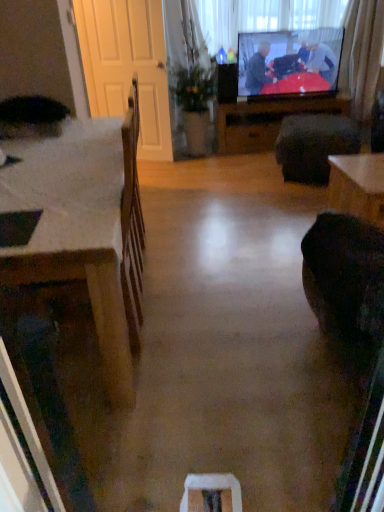
Question: Does green leafy plant at center have a lesser height compared to flat screen tv at upper center?

Choices:
 (A) no
 (B) yes

Answer: (A)

Question: Does green leafy plant at center have a greater width compared to flat screen tv at upper center?

Choices:
 (A) no
 (B) yes

Answer: (B)

Question: Is green leafy plant at center far away from flat screen tv at upper center?

Choices:
 (A) yes
 (B) no

Answer: (B)

Question: Is flat screen tv at upper center inside green leafy plant at center?

Choices:
 (A) yes
 (B) no

Answer: (B)

Question: Considering the relative positions of green leafy plant at center and flat screen tv at upper center in the image provided, is green leafy plant at center to the left of flat screen tv at upper center from the viewer's perspective?

Choices:
 (A) yes
 (B) no

Answer: (A)

Question: Considering the positions of transparent plastic window screen at upper center and white wooden screen door at left in the image, is transparent plastic window screen at upper center wider or thinner than white wooden screen door at left?

Choices:
 (A) wide
 (B) thin

Answer: (A)

Question: Visually, is transparent plastic window screen at upper center positioned to the left or to the right of white wooden screen door at left?

Choices:
 (A) left
 (B) right

Answer: (B)

Question: Is transparent plastic window screen at upper center taller or shorter than white wooden screen door at left?

Choices:
 (A) tall
 (B) short

Answer: (B)

Question: Considering the positions of point (200, 20) and point (132, 46), is point (200, 20) closer or farther from the camera than point (132, 46)?

Choices:
 (A) farther
 (B) closer

Answer: (A)

Question: From the image's perspective, is wooden table at center, positioned as the 2th table in front-to-back order, positioned above or below green leafy plant at center?

Choices:
 (A) above
 (B) below

Answer: (B)

Question: Is wooden table at center, positioned as the 2th table in front-to-back order, wider or thinner than green leafy plant at center?

Choices:
 (A) thin
 (B) wide

Answer: (A)

Question: Is wooden table at center, arranged as the first table when viewed from the top, inside or outside of green leafy plant at center?

Choices:
 (A) inside
 (B) outside

Answer: (B)

Question: Relative to green leafy plant at center, is wooden table at center, the first table when ordered from back to front, in front or behind?

Choices:
 (A) behind
 (B) front

Answer: (A)

Question: Looking at their shapes, would you say white wooden screen door at left is wider or thinner than curtain at upper right?

Choices:
 (A) wide
 (B) thin

Answer: (B)

Question: Do you think white wooden screen door at left is within curtain at upper right, or outside of it?

Choices:
 (A) outside
 (B) inside

Answer: (A)